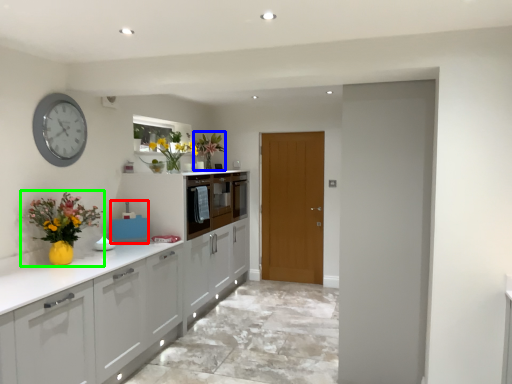
Question: Considering the real-world distances, which object is farthest from appliance (highlighted by a red box)? floral arrangement (highlighted by a blue box) or floral arrangement (highlighted by a green box)?

Choices:
 (A) floral arrangement
 (B) floral arrangement

Answer: (A)